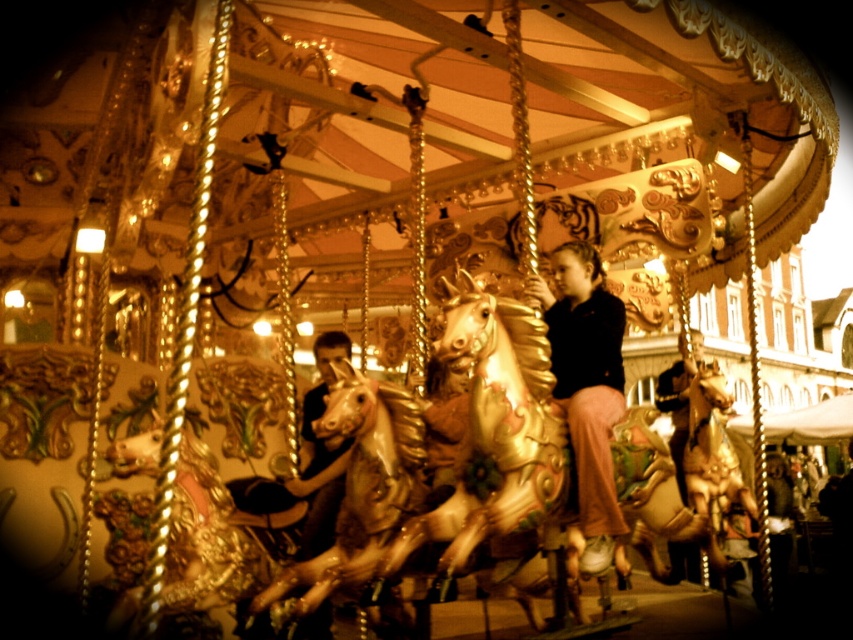
Between matte black jacket at center and matte black shirt at center, which one appears on the left side from the viewer's perspective?

From the viewer's perspective, matte black shirt at center appears more on the left side.

Which is in front, point (583, 316) or point (312, 413)?

Point (583, 316) is in front.

This screenshot has width=853, height=640. Describe the element at coordinates (587, 390) in the screenshot. I see `matte black jacket at center` at that location.

I want to click on matte black jacket at center, so click(x=587, y=390).